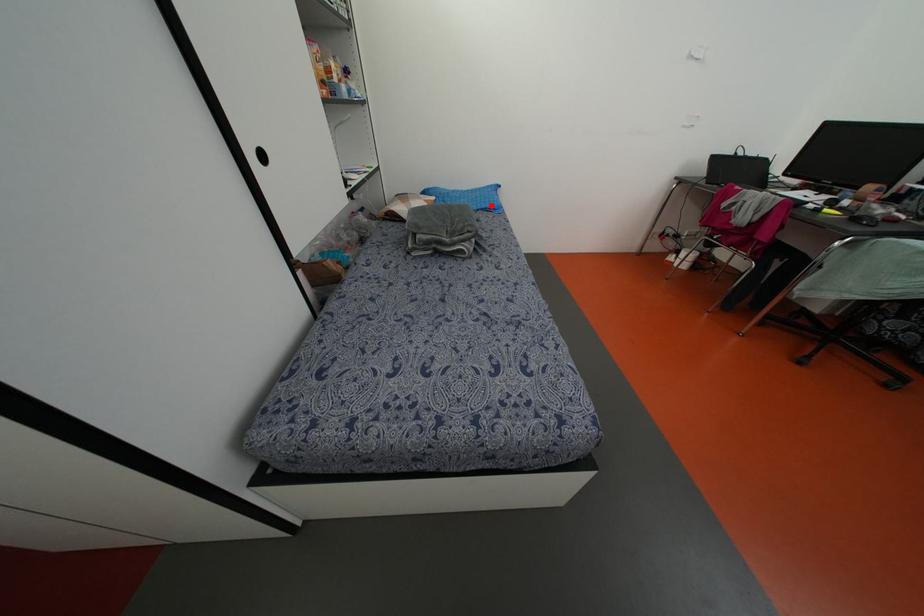
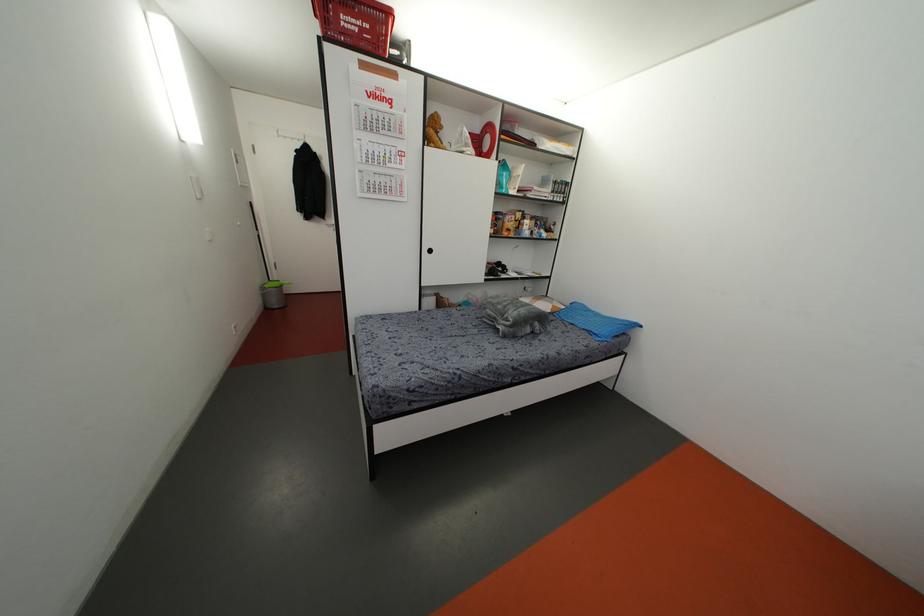
Where in the second image is the point corresponding to the highlighted location from the first image?

(596, 331)